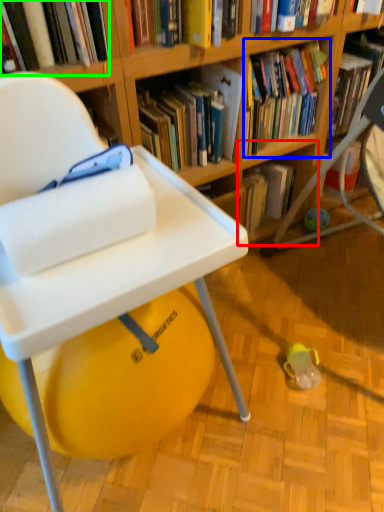
Question: Which is nearer to the shelf (highlighted by a red box)? book (highlighted by a blue box) or book (highlighted by a green box).

Choices:
 (A) book
 (B) book

Answer: (A)